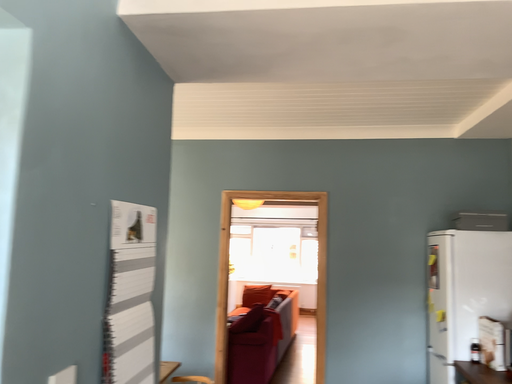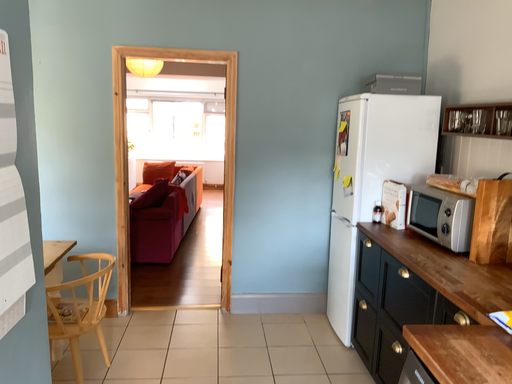
Question: Which way did the camera rotate in the video?

Choices:
 (A) rotated left
 (B) rotated right

Answer: (B)